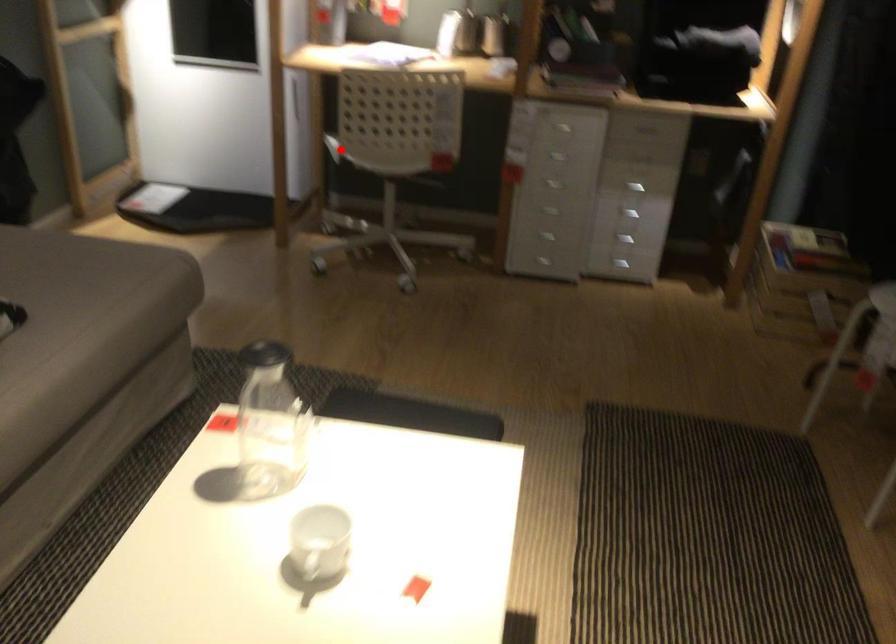
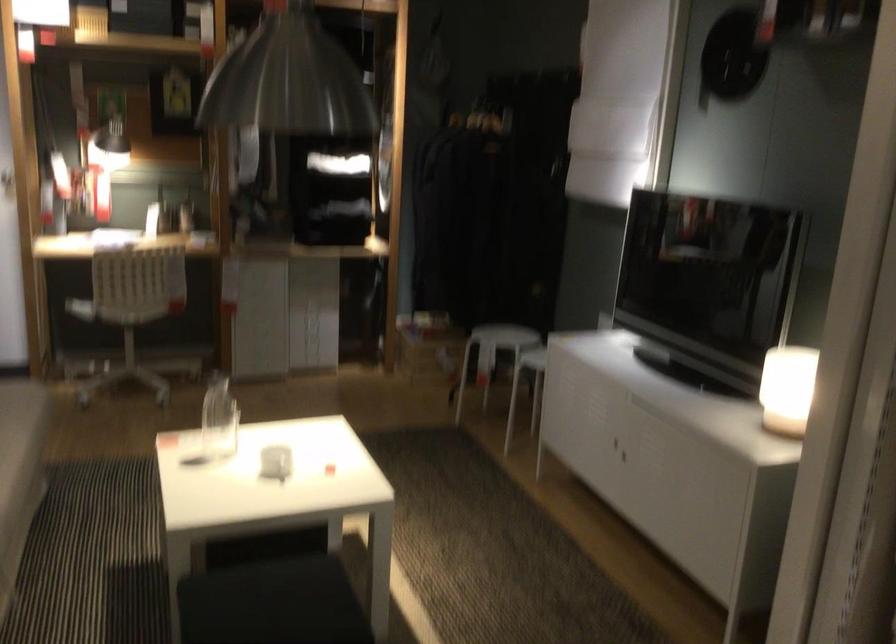
Question: I am providing you with two images of the same scene from different viewpoints. In image1, a red point is highlighted. Considering the same 3D point in image2, which of the following is correct?

Choices:
 (A) It is closer
 (B) It is farther

Answer: (B)